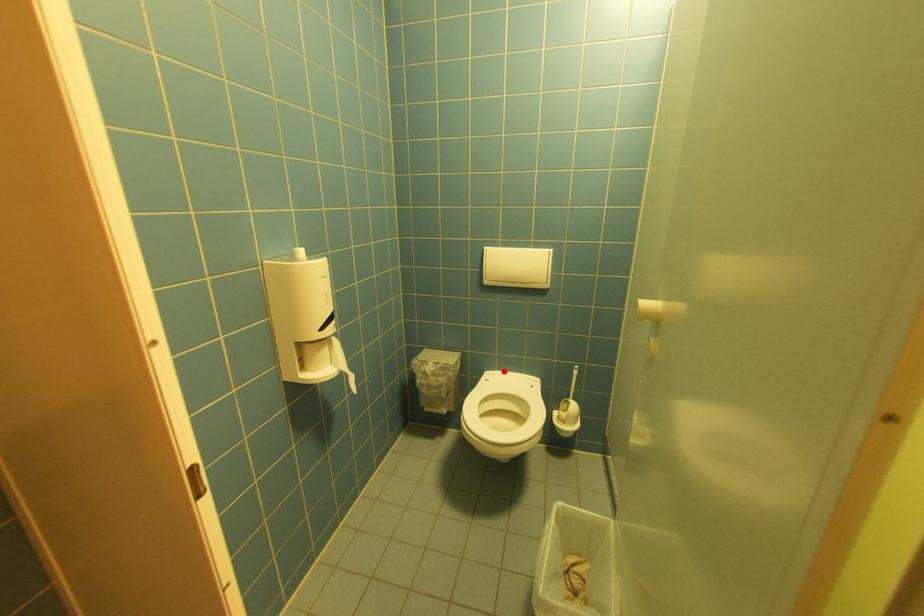
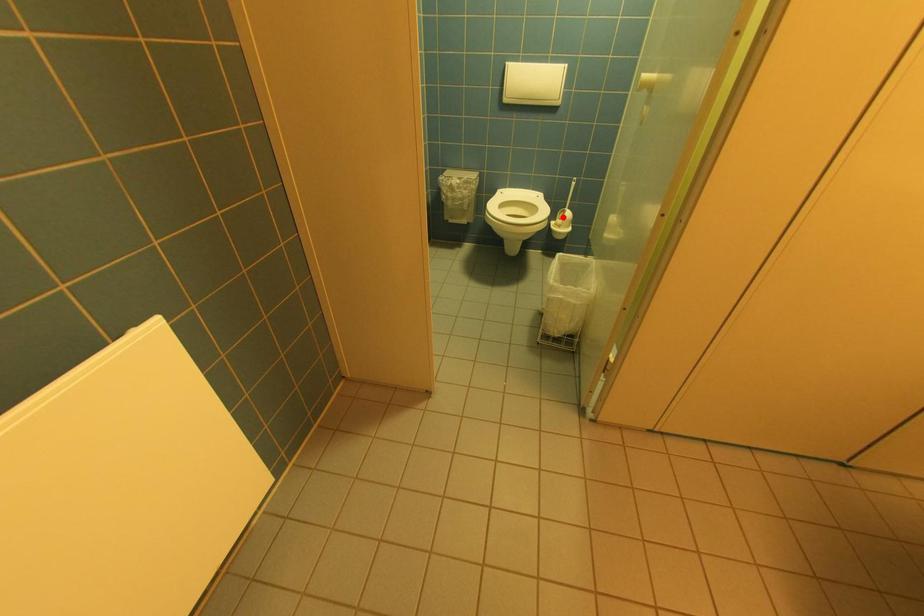
I am providing you with two images of the same scene from different viewpoints. A red point is marked on the first image and another point is marked on the second image. Do the highlighted points in image1 and image2 indicate the same real-world spot?

No